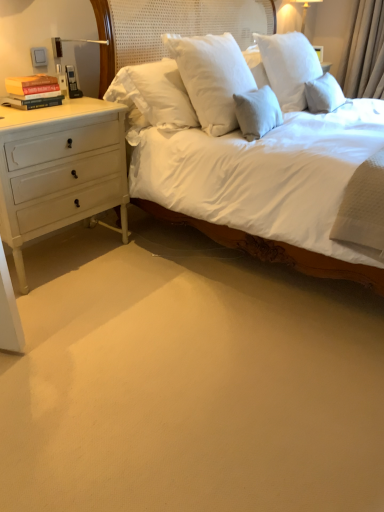
Image resolution: width=384 pixels, height=512 pixels. What do you see at coordinates (304, 9) in the screenshot? I see `white glossy lampshade at upper right` at bounding box center [304, 9].

Looking at this image, measure the distance between white painted wood chest of drawers at left and camera.

The depth of white painted wood chest of drawers at left is 1.71 meters.

The height and width of the screenshot is (512, 384). Describe the element at coordinates (59, 169) in the screenshot. I see `white painted wood chest of drawers at left` at that location.

Where is `beige fabric curtain at upper right`? This screenshot has height=512, width=384. beige fabric curtain at upper right is located at coordinates (364, 52).

The height and width of the screenshot is (512, 384). What are the coordinates of `hardcover books at left` in the screenshot? It's located at (32, 92).

Considering the sizes of white painted wood chest of drawers at left and beige fabric curtain at upper right in the image, is white painted wood chest of drawers at left bigger or smaller than beige fabric curtain at upper right?

In the image, white painted wood chest of drawers at left appears to be larger than beige fabric curtain at upper right.

Which object is closer to the camera taking this photo, white painted wood chest of drawers at left or beige fabric curtain at upper right?

white painted wood chest of drawers at left.

From the picture: Are white painted wood chest of drawers at left and beige fabric curtain at upper right located far from each other?

Yes, white painted wood chest of drawers at left is far from beige fabric curtain at upper right.

Would you say white painted wood chest of drawers at left is outside beige fabric curtain at upper right?

Yes, white painted wood chest of drawers at left is outside of beige fabric curtain at upper right.

In the scene shown: Is white glossy lampshade at upper right with hardcover books at left?

No, white glossy lampshade at upper right is not with hardcover books at left.

Locate an element on the screen. The width and height of the screenshot is (384, 512). book on the left of white glossy lampshade at upper right is located at coordinates (32, 92).

Considering the sizes of objects white glossy lampshade at upper right and hardcover books at left in the image provided, who is wider, white glossy lampshade at upper right or hardcover books at left?

white glossy lampshade at upper right.

From their relative heights in the image, would you say white glossy lampshade at upper right is taller or shorter than hardcover books at left?

Clearly, white glossy lampshade at upper right is taller compared to hardcover books at left.

Considering the relative sizes of beige fabric curtain at upper right and hardcover books at left in the image provided, is beige fabric curtain at upper right wider than hardcover books at left?

Yes.

Between beige fabric curtain at upper right and hardcover books at left, which one has larger size?

beige fabric curtain at upper right is bigger.

Would you say hardcover books at left is part of beige fabric curtain at upper right's contents?

No, hardcover books at left is not a part of beige fabric curtain at upper right.

Would you say beige fabric curtain at upper right is a long distance from hardcover books at left?

Absolutely, beige fabric curtain at upper right is distant from hardcover books at left.

Which is behind, point (17, 92) or point (64, 215)?

The point (64, 215) is more distant.

Who is smaller, hardcover books at left or white painted wood chest of drawers at left?

hardcover books at left is smaller.

From the picture: From the image's perspective, is hardcover books at left on white painted wood chest of drawers at left?

Yes, from the image's perspective, hardcover books at left is on top of white painted wood chest of drawers at left.

Can you confirm if hardcover books at left is taller than white painted wood chest of drawers at left?

No, hardcover books at left is not taller than white painted wood chest of drawers at left.

How different are the orientations of hardcover books at left and white glossy lampshade at upper right in degrees?

hardcover books at left and white glossy lampshade at upper right are facing 7.53e-05 degrees away from each other.

Is hardcover books at left closer to camera compared to white glossy lampshade at upper right?

Yes, hardcover books at left is in front of white glossy lampshade at upper right.

In the scene shown: Which of these two, hardcover books at left or white glossy lampshade at upper right, stands taller?

Standing taller between the two is white glossy lampshade at upper right.

At what (x,y) coordinates should I click in order to perform the action: click on bedside lamp located on the right of hardcover books at left. Please return your answer as a coordinate pair (x, y). This screenshot has width=384, height=512. Looking at the image, I should click on (304, 9).

Based on their positions, is beige fabric curtain at upper right located to the left or right of white glossy lampshade at upper right?

Clearly, beige fabric curtain at upper right is on the right of white glossy lampshade at upper right in the image.

Is beige fabric curtain at upper right outside of white glossy lampshade at upper right?

beige fabric curtain at upper right lies outside white glossy lampshade at upper right's area.

From a real-world perspective, is beige fabric curtain at upper right beneath white glossy lampshade at upper right?

Yes, from a real-world perspective, beige fabric curtain at upper right is under white glossy lampshade at upper right.

Between point (359, 35) and point (302, 1), which one is positioned behind?

The point (302, 1) is more distant.

Is white painted wood chest of drawers at left inside beige fabric curtain at upper right?

No, white painted wood chest of drawers at left is not surrounded by beige fabric curtain at upper right.

Locate an element on the screen. curtain above the white painted wood chest of drawers at left (from a real-world perspective) is located at coordinates (364, 52).

Is point (357, 47) closer to camera compared to point (104, 159)?

No.

Is beige fabric curtain at upper right beside white painted wood chest of drawers at left?

They are not placed beside each other.

Identify the location of the chest of drawers that is in front of the beige fabric curtain at upper right. The image size is (384, 512). (59, 169).

Locate an element on the screen. Image resolution: width=384 pixels, height=512 pixels. book that is under the white glossy lampshade at upper right (from a real-world perspective) is located at coordinates (32, 92).

Based on their spatial positions, is beige fabric curtain at upper right or white glossy lampshade at upper right further from white painted wood chest of drawers at left?

Based on the image, white glossy lampshade at upper right appears to be further to white painted wood chest of drawers at left.

From the image, which object appears to be farther from beige fabric curtain at upper right, hardcover books at left or white painted wood chest of drawers at left?

hardcover books at left.

Looking at the image, which one is located closer to hardcover books at left, beige fabric curtain at upper right or white glossy lampshade at upper right?

Among the two, white glossy lampshade at upper right is located nearer to hardcover books at left.

Looking at the image, which one is located further to beige fabric curtain at upper right, hardcover books at left or white glossy lampshade at upper right?

hardcover books at left.

Based on their spatial positions, is white glossy lampshade at upper right or hardcover books at left further from white painted wood chest of drawers at left?

white glossy lampshade at upper right is positioned further to the anchor white painted wood chest of drawers at left.

Looking at the image, which one is located closer to hardcover books at left, beige fabric curtain at upper right or white painted wood chest of drawers at left?

white painted wood chest of drawers at left is positioned closer to the anchor hardcover books at left.

Based on their spatial positions, is white glossy lampshade at upper right or white painted wood chest of drawers at left further from hardcover books at left?

The object further to hardcover books at left is white glossy lampshade at upper right.

From the image, which object appears to be nearer to white glossy lampshade at upper right, white painted wood chest of drawers at left or beige fabric curtain at upper right?

beige fabric curtain at upper right lies closer to white glossy lampshade at upper right than the other object.

The width and height of the screenshot is (384, 512). What are the coordinates of `bedside lamp situated between hardcover books at left and beige fabric curtain at upper right from left to right` in the screenshot? It's located at (304, 9).

The height and width of the screenshot is (512, 384). I want to click on chest of drawers between hardcover books at left and beige fabric curtain at upper right, so click(x=59, y=169).

Locate an element on the screen. book between white painted wood chest of drawers at left and white glossy lampshade at upper right along the z-axis is located at coordinates (32, 92).

Identify the location of bedside lamp between white painted wood chest of drawers at left and beige fabric curtain at upper right in the horizontal direction. The height and width of the screenshot is (512, 384). (304, 9).